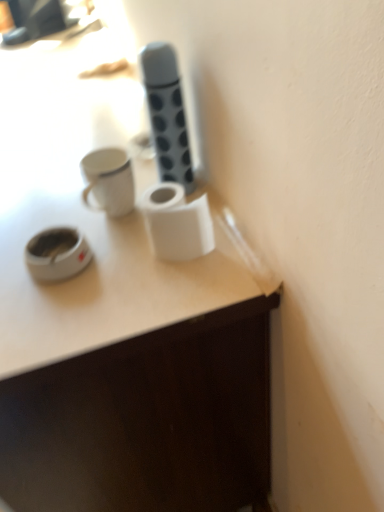
Question: Should I look upward or downward to see white matte paper towel at center?

Choices:
 (A) up
 (B) down

Answer: (A)